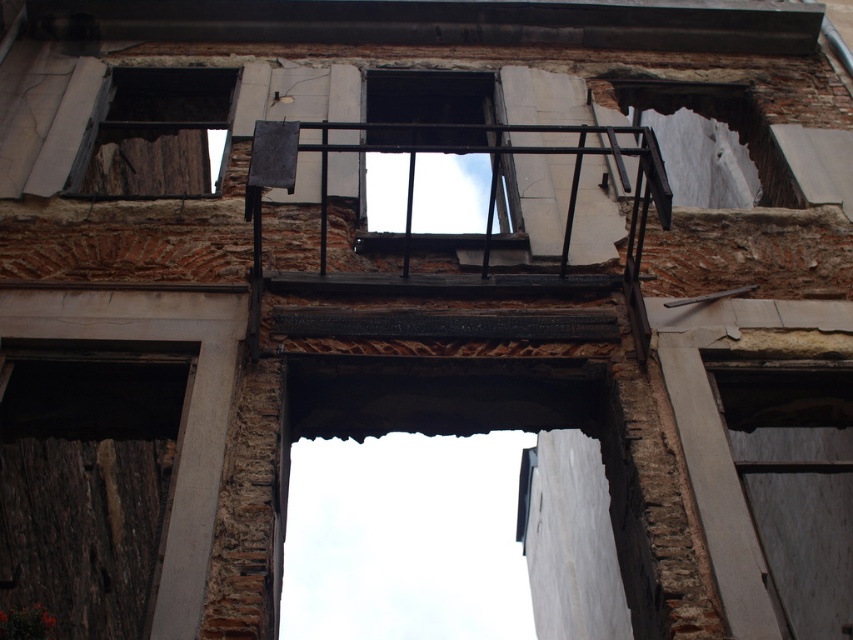
Question: Which point appears closest to the camera in this image?

Choices:
 (A) (836, 422)
 (B) (386, 193)

Answer: (A)

Question: Which point is closer to the camera taking this photo?

Choices:
 (A) (206, 166)
 (B) (757, 516)
 (C) (427, 186)

Answer: (B)

Question: Can you confirm if metallic black balcony at center is positioned above dark brown wood at upper left?

Choices:
 (A) yes
 (B) no

Answer: (A)

Question: Based on their relative distances, which object is farther from the metallic black balcony at center?

Choices:
 (A) dark brown wood at upper left
 (B) smooth white window at lower right

Answer: (B)

Question: Is smooth white window at lower right further to camera compared to dark brown wood at upper left?

Choices:
 (A) no
 (B) yes

Answer: (A)

Question: Does metallic black balcony at center have a greater width compared to dark brown wood at upper left?

Choices:
 (A) yes
 (B) no

Answer: (A)